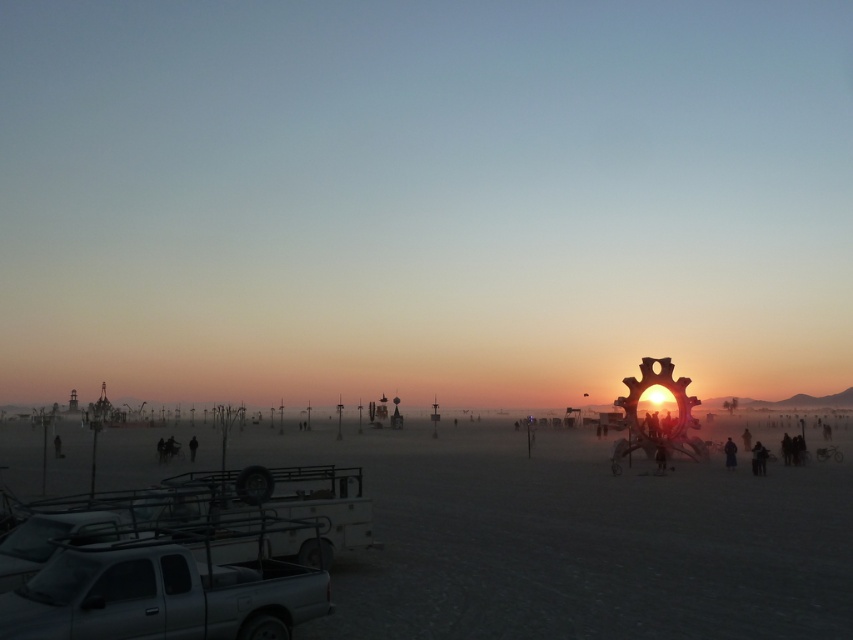
Question: Among these points, which one is nearest to the camera?

Choices:
 (A) (836, 449)
 (B) (190, 454)
 (C) (764, 472)

Answer: (C)

Question: Estimate the real-world distances between objects in this image. Which object is closer to the dark gray fabric jacket at lower right?

Choices:
 (A) black matte person at lower left
 (B) metallic silver truck at lower left
 (C) white sand beach at lower left

Answer: (B)

Question: Can you confirm if metallic silver truck at lower left is bigger than dark skin textured pants at lower right?

Choices:
 (A) no
 (B) yes

Answer: (A)

Question: Can you confirm if dark gray fabric jacket at lower right is positioned above dark fabric figure at center?

Choices:
 (A) no
 (B) yes

Answer: (A)

Question: Estimate the real-world distances between objects in this image. Which object is farther from the black matte person at lower left?

Choices:
 (A) dark brown leather jacket at lower right
 (B) white matte truck at lower left
 (C) white sand beach at lower left
 (D) dark skin textured pants at lower right

Answer: (D)

Question: From the image, what is the correct spatial relationship of dark gray fabric jacket at lower right in relation to dark skin textured pants at lower right?

Choices:
 (A) left
 (B) right

Answer: (A)